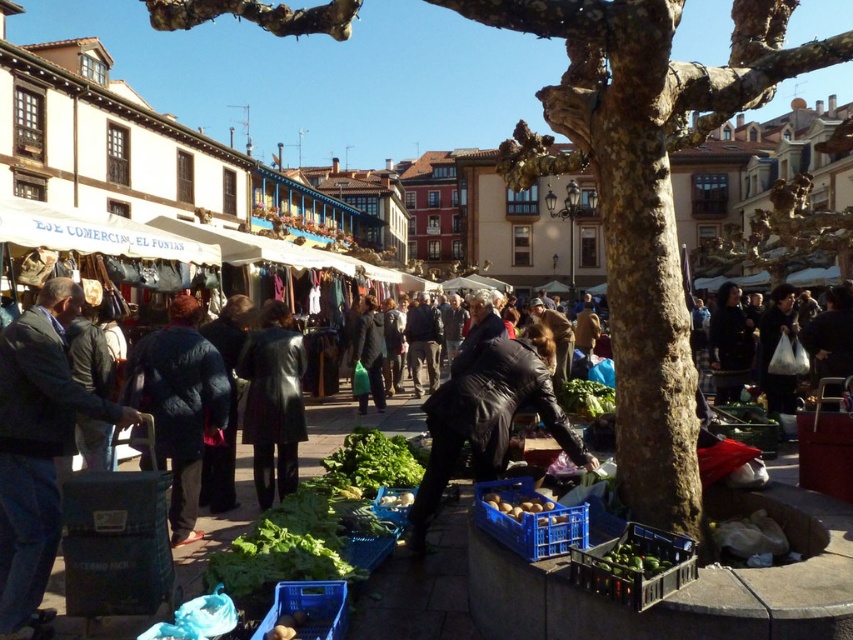
Question: Can you confirm if dark fabric coat at center is smaller than dark gray coat at center?

Choices:
 (A) no
 (B) yes

Answer: (A)

Question: Is dark gray coat at center wider than smooth brown potatoes at lower center?

Choices:
 (A) yes
 (B) no

Answer: (B)

Question: Is brown rough tree trunk at center closer to the viewer compared to dark fabric coat at center?

Choices:
 (A) yes
 (B) no

Answer: (A)

Question: Which point is farther to the camera?

Choices:
 (A) (561, 385)
 (B) (33, 573)
 (C) (373, 385)

Answer: (C)

Question: Considering the real-world distances, which object is closest to the green matte avocados at lower center?

Choices:
 (A) dark blue suit at left
 (B) dark gray coat at center
 (C) green leafy vegetables at center
 (D) black leather coat at center

Answer: (C)

Question: Among these points, which one is nearest to the camera?

Choices:
 (A) (653, 566)
 (B) (583, 410)
 (C) (254, 436)
 (D) (229, 552)

Answer: (A)